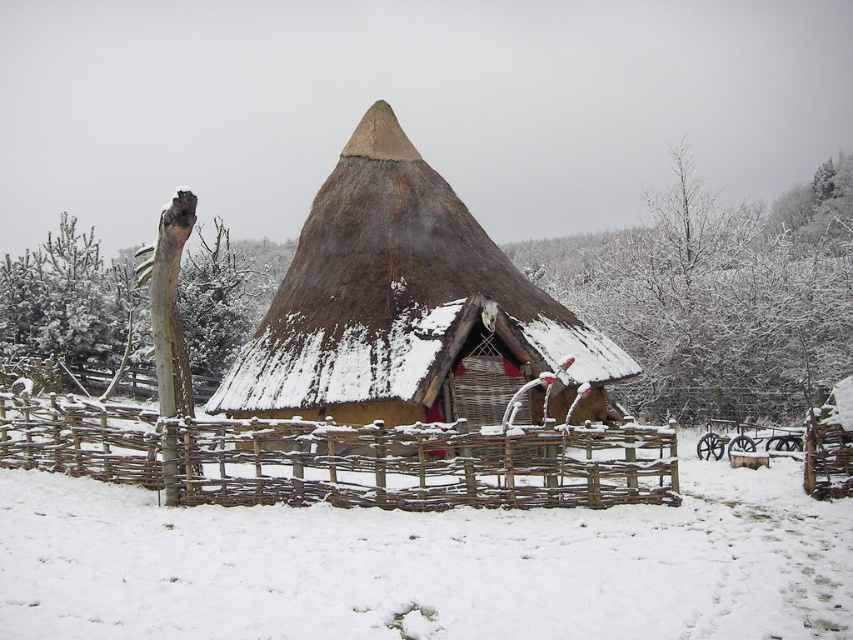
Question: Based on their relative distances, which object is nearer to the thatched straw hut at center?

Choices:
 (A) white fluffy snow at center
 (B) woven wood fence at center

Answer: (B)

Question: Among these points, which one is nearest to the camera?

Choices:
 (A) (54, 412)
 (B) (173, 604)

Answer: (B)

Question: Does thatched straw hut at center have a lesser width compared to woven wood fence at center?

Choices:
 (A) yes
 (B) no

Answer: (A)

Question: Where is thatched straw hut at center located in relation to woven wood fence at center in the image?

Choices:
 (A) below
 (B) above

Answer: (B)

Question: Is thatched straw hut at center wider than woven wood fence at center?

Choices:
 (A) no
 (B) yes

Answer: (A)

Question: Which of these objects is positioned closest to the white fluffy snow at center?

Choices:
 (A) thatched straw hut at center
 (B) woven wood fence at center

Answer: (B)